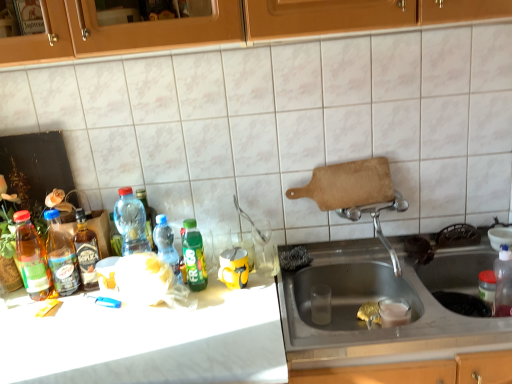
What do you see at coordinates (503, 283) in the screenshot? The image size is (512, 384). I see `translucent plastic bottle at sink right, which is the seventh bottle from left to right` at bounding box center [503, 283].

Find the location of a particular element. translucent plastic bottle at left, positioned as the second bottle in left-to-right order is located at coordinates (61, 256).

What do you see at coordinates (61, 256) in the screenshot? The height and width of the screenshot is (384, 512). I see `translucent plastic bottle at left, positioned as the second bottle in left-to-right order` at bounding box center [61, 256].

What are the coordinates of `stainless steel sink at lower right` in the screenshot? It's located at (384, 298).

Describe the element at coordinates (32, 258) in the screenshot. The image size is (512, 384). I see `translucent plastic bottle at left, which ranks as the 1th bottle in left-to-right order` at that location.

Identify the location of translucent plastic bottle at sink right, which is the seventh bottle from left to right. (503, 283).

From the image's perspective, is translucent plastic bottle at left, positioned as the second bottle in left-to-right order, located above green matte bottle at center, which is counted as the second bottle, starting from the right?

No, from the image's perspective, translucent plastic bottle at left, positioned as the second bottle in left-to-right order, is not over green matte bottle at center, which is counted as the second bottle, starting from the right.

Considering the positions of objects translucent plastic bottle at left, the 6th bottle positioned from the right, and green matte bottle at center, which is counted as the second bottle, starting from the right, in the image provided, who is behind, translucent plastic bottle at left, the 6th bottle positioned from the right, or green matte bottle at center, which is counted as the second bottle, starting from the right,?

translucent plastic bottle at left, the 6th bottle positioned from the right, is behind.

Is translucent plastic bottle at left, the 6th bottle positioned from the right, inside the boundaries of green matte bottle at center, which is counted as the sixth bottle, starting from the left, or outside?

translucent plastic bottle at left, the 6th bottle positioned from the right, is outside green matte bottle at center, which is counted as the sixth bottle, starting from the left.

Is translucent plastic bottle at sink right, the 1th bottle in the right-to-left sequence, oriented away from translucent plastic bottle at center, positioned as the 3th bottle in right-to-left order?

No, translucent plastic bottle at sink right, the 1th bottle in the right-to-left sequence, is not facing away from translucent plastic bottle at center, positioned as the 3th bottle in right-to-left order.

Considering the relative sizes of translucent plastic bottle at sink right, which is the seventh bottle from left to right, and translucent plastic bottle at center, which is counted as the 5th bottle, starting from the left, in the image provided, is translucent plastic bottle at sink right, which is the seventh bottle from left to right, taller than translucent plastic bottle at center, which is counted as the 5th bottle, starting from the left,?

Yes, translucent plastic bottle at sink right, which is the seventh bottle from left to right, is taller than translucent plastic bottle at center, which is counted as the 5th bottle, starting from the left.

Which point is more distant from viewer, (501,272) or (167,250)?

The point (167,250) is farther from the camera.

Can you see translucent plastic bottle at sink right, which is the seventh bottle from left to right, touching white marble countertop at center?

No, translucent plastic bottle at sink right, which is the seventh bottle from left to right, is not touching white marble countertop at center.

Based on their sizes in the image, would you say translucent plastic bottle at sink right, the 1th bottle in the right-to-left sequence, is bigger or smaller than white marble countertop at center?

translucent plastic bottle at sink right, the 1th bottle in the right-to-left sequence, is smaller than white marble countertop at center.

In the image, is translucent plastic bottle at sink right, the 1th bottle in the right-to-left sequence, positioned in front of or behind white marble countertop at center?

Visually, translucent plastic bottle at sink right, the 1th bottle in the right-to-left sequence, is located behind white marble countertop at center.

Which object is wider, translucent plastic bottle at sink right, the 1th bottle in the right-to-left sequence, or white marble countertop at center?

white marble countertop at center.

Consider the image. Is white marble countertop at center taller than green matte bottle at center, which is counted as the sixth bottle, starting from the left?

Correct, white marble countertop at center is much taller as green matte bottle at center, which is counted as the sixth bottle, starting from the left.

Between white marble countertop at center and green matte bottle at center, which is counted as the sixth bottle, starting from the left, which one has larger width?

white marble countertop at center is wider.

Can green matte bottle at center, which is counted as the second bottle, starting from the right, be found inside white marble countertop at center?

That's incorrect, green matte bottle at center, which is counted as the second bottle, starting from the right, is not inside white marble countertop at center.

Is green matte bottle at center, which is counted as the second bottle, starting from the right, at the back of white marble countertop at center?

No, green matte bottle at center, which is counted as the second bottle, starting from the right, is not at the back of white marble countertop at center.

Considering the sizes of objects translucent plastic bottle at left, the 6th bottle positioned from the right, and white marble countertop at center in the image provided, who is shorter, translucent plastic bottle at left, the 6th bottle positioned from the right, or white marble countertop at center?

Standing shorter between the two is translucent plastic bottle at left, the 6th bottle positioned from the right.

Does translucent plastic bottle at left, the 6th bottle positioned from the right, turn towards white marble countertop at center?

No.

What's the angular difference between translucent plastic bottle at left, positioned as the second bottle in left-to-right order, and white marble countertop at center's facing directions?

The angle between the facing direction of translucent plastic bottle at left, positioned as the second bottle in left-to-right order, and the facing direction of white marble countertop at center is 0.00174 degrees.

From the image's perspective, between translucent plastic bottle at left, the 6th bottle positioned from the right, and white marble countertop at center, who is located below?

From the image's view, white marble countertop at center is below.

Based on their sizes in the image, would you say translucent plastic bottle at center, positioned as the 3th bottle in right-to-left order, is bigger or smaller than translucent glass bottle at left, which is counted as the third bottle, starting from the left?

In the image, translucent plastic bottle at center, positioned as the 3th bottle in right-to-left order, appears to be smaller than translucent glass bottle at left, which is counted as the third bottle, starting from the left.

Considering their positions, is translucent plastic bottle at center, which is counted as the 5th bottle, starting from the left, located in front of or behind translucent glass bottle at left, the fifth bottle when ordered from right to left?

In the image, translucent plastic bottle at center, which is counted as the 5th bottle, starting from the left, appears behind translucent glass bottle at left, the fifth bottle when ordered from right to left.

From the image's perspective, is translucent plastic bottle at center, positioned as the 3th bottle in right-to-left order, above translucent glass bottle at left, which is counted as the third bottle, starting from the left?

Correct, translucent plastic bottle at center, positioned as the 3th bottle in right-to-left order, appears higher than translucent glass bottle at left, which is counted as the third bottle, starting from the left, in the image.

Can you confirm if translucent plastic bottle at left, which ranks as the 1th bottle in left-to-right order, is shorter than translucent glass bottle at left, which is counted as the third bottle, starting from the left?

In fact, translucent plastic bottle at left, which ranks as the 1th bottle in left-to-right order, may be taller than translucent glass bottle at left, which is counted as the third bottle, starting from the left.

In the scene shown: Is translucent plastic bottle at left, the seventh bottle when ordered from right to left, oriented away from translucent glass bottle at left, which is counted as the third bottle, starting from the left?

translucent plastic bottle at left, the seventh bottle when ordered from right to left, does not have its back to translucent glass bottle at left, which is counted as the third bottle, starting from the left.

Considering the relative positions of translucent plastic bottle at left, the seventh bottle when ordered from right to left, and translucent glass bottle at left, which is counted as the third bottle, starting from the left, in the image provided, is translucent plastic bottle at left, the seventh bottle when ordered from right to left, to the left of translucent glass bottle at left, which is counted as the third bottle, starting from the left, from the viewer's perspective?

Correct, you'll find translucent plastic bottle at left, the seventh bottle when ordered from right to left, to the left of translucent glass bottle at left, which is counted as the third bottle, starting from the left.

From a real-world perspective, between translucent plastic bottle at left, the seventh bottle when ordered from right to left, and translucent glass bottle at left, the fifth bottle when ordered from right to left, who is vertically higher?

From a 3D spatial view, translucent glass bottle at left, the fifth bottle when ordered from right to left, is above.

Image resolution: width=512 pixels, height=384 pixels. In order to click on bottle that is the 1st object located below the green matte bottle at center, which is counted as the sixth bottle, starting from the left (from the image's perspective) in this screenshot , I will do `click(61, 256)`.

This screenshot has height=384, width=512. I want to click on the 2nd bottle to the left of the translucent plastic bottle at sink right, which is the seventh bottle from left to right, starting your count from the anchor, so click(x=167, y=245).

Considering their positions, is translucent plastic bottle at center-left, which is counted as the 4th bottle, starting from the right, positioned closer to white marble countertop at center than translucent glass bottle at left, the fifth bottle when ordered from right to left?

translucent glass bottle at left, the fifth bottle when ordered from right to left, lies closer to white marble countertop at center than the other object.

Considering their positions, is translucent plastic bottle at sink right, the 1th bottle in the right-to-left sequence, positioned further to translucent plastic bottle at left, positioned as the second bottle in left-to-right order, than green matte bottle at center, which is counted as the sixth bottle, starting from the left?

Among the two, translucent plastic bottle at sink right, the 1th bottle in the right-to-left sequence, is located further to translucent plastic bottle at left, positioned as the second bottle in left-to-right order.

Estimate the real-world distances between objects in this image. Which object is further from translucent plastic bottle at left, which ranks as the 1th bottle in left-to-right order, green matte bottle at center, which is counted as the second bottle, starting from the right, or white marble countertop at center?

white marble countertop at center is positioned further to the anchor translucent plastic bottle at left, which ranks as the 1th bottle in left-to-right order.

Looking at this image, looking at the image, which one is located further to translucent plastic bottle at left, the seventh bottle when ordered from right to left, translucent glass bottle at left, which is counted as the third bottle, starting from the left, or translucent plastic bottle at sink right, the 1th bottle in the right-to-left sequence?

translucent plastic bottle at sink right, the 1th bottle in the right-to-left sequence.

Based on the photo, looking at the image, which one is located closer to stainless steel sink at lower right, translucent glass bottle at left, the fifth bottle when ordered from right to left, or translucent plastic bottle at center, which is counted as the 5th bottle, starting from the left?

The object closer to stainless steel sink at lower right is translucent plastic bottle at center, which is counted as the 5th bottle, starting from the left.

Which object lies further to the anchor point translucent plastic bottle at center, positioned as the 3th bottle in right-to-left order, translucent glass bottle at left, the fifth bottle when ordered from right to left, or white marble countertop at center?

white marble countertop at center.

Considering their positions, is stainless steel sink at lower right positioned further to translucent plastic bottle at left, the 6th bottle positioned from the right, than white marble countertop at center?

Based on the image, stainless steel sink at lower right appears to be further to translucent plastic bottle at left, the 6th bottle positioned from the right.

Considering their positions, is translucent plastic bottle at sink right, the 1th bottle in the right-to-left sequence, positioned closer to translucent plastic bottle at left, the seventh bottle when ordered from right to left, than translucent plastic bottle at center-left, which is counted as the 4th bottle, starting from the right?

translucent plastic bottle at center-left, which is counted as the 4th bottle, starting from the right, is positioned closer to the anchor translucent plastic bottle at left, the seventh bottle when ordered from right to left.

Find the location of a particular element. The image size is (512, 384). sink between green matte bottle at center, which is counted as the sixth bottle, starting from the left, and translucent plastic bottle at sink right, which is the seventh bottle from left to right is located at coordinates (384, 298).

Where is `sink between white marble countertop at center and translucent plastic bottle at sink right, which is the seventh bottle from left to right`? The height and width of the screenshot is (384, 512). sink between white marble countertop at center and translucent plastic bottle at sink right, which is the seventh bottle from left to right is located at coordinates (384, 298).

Where is `counter top between translucent glass bottle at left, the fifth bottle when ordered from right to left, and stainless steel sink at lower right`? The height and width of the screenshot is (384, 512). counter top between translucent glass bottle at left, the fifth bottle when ordered from right to left, and stainless steel sink at lower right is located at coordinates (241, 333).

Image resolution: width=512 pixels, height=384 pixels. I want to click on counter top between translucent plastic bottle at center-left, which is counted as the 4th bottle, starting from the right, and translucent plastic bottle at sink right, the 1th bottle in the right-to-left sequence, so click(241, 333).